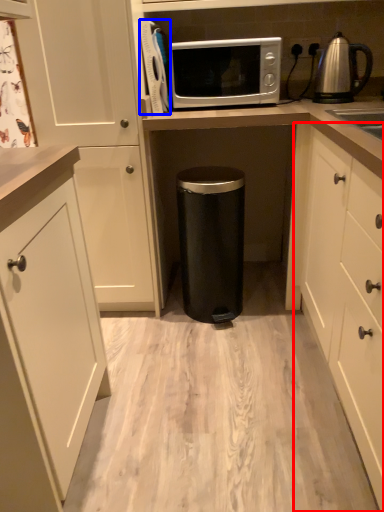
Question: Which of the following is the farthest to the observer, cabinetry (highlighted by a red box) or appliance (highlighted by a blue box)?

Choices:
 (A) cabinetry
 (B) appliance

Answer: (B)